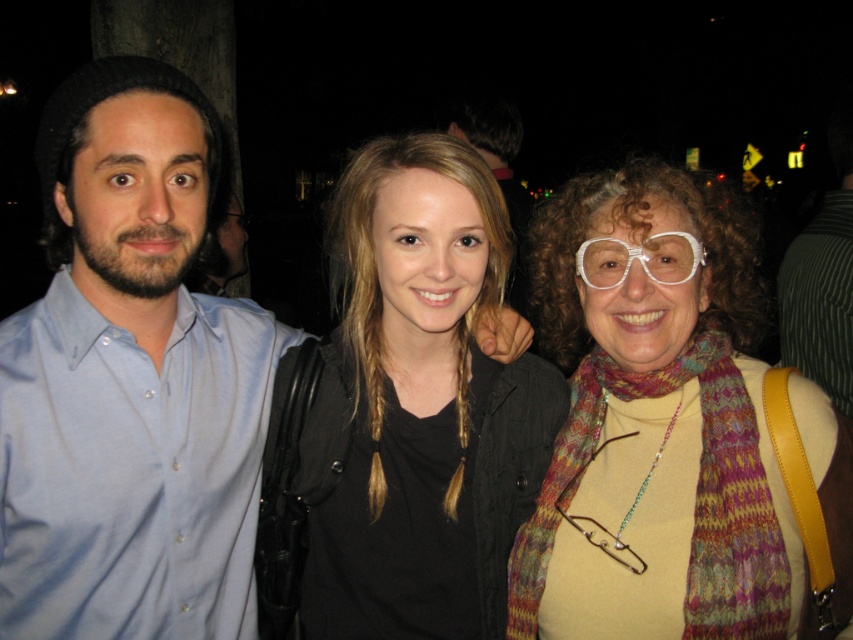
You are a photographer trying to adjust the focus of your camera to capture the black matte jacket at center clearly. Given that the camera focuses on objects at point coordinates between 0.5 and 0.6 on both axes, will the jacket be in focus?

The black matte jacket at center is located at point coordinates (418, 406), which falls within the focus range of 0.5 to 0.6 on both axes. Therefore, the jacket will be in focus.

You are a photographer trying to adjust the focus of your camera. You notice two items in the scene that need to be in focus simultaneously. The items are the matte blue shirt at left and the metallic wire glasses at center. Given their positions, which item should you focus on first to ensure both are in sharp focus?

The matte blue shirt at left has a greater height compared to metallic wire glasses at center. Since the shirt is taller, focusing on it first would likely ensure both are in focus as the glasses are closer to the camera.